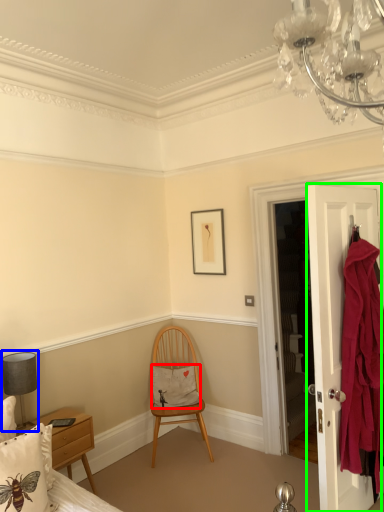
Question: Which object is the closest to the pillow (highlighted by a red box)? Choose among these: lamp (highlighted by a blue box) or door (highlighted by a green box).

Choices:
 (A) lamp
 (B) door

Answer: (A)